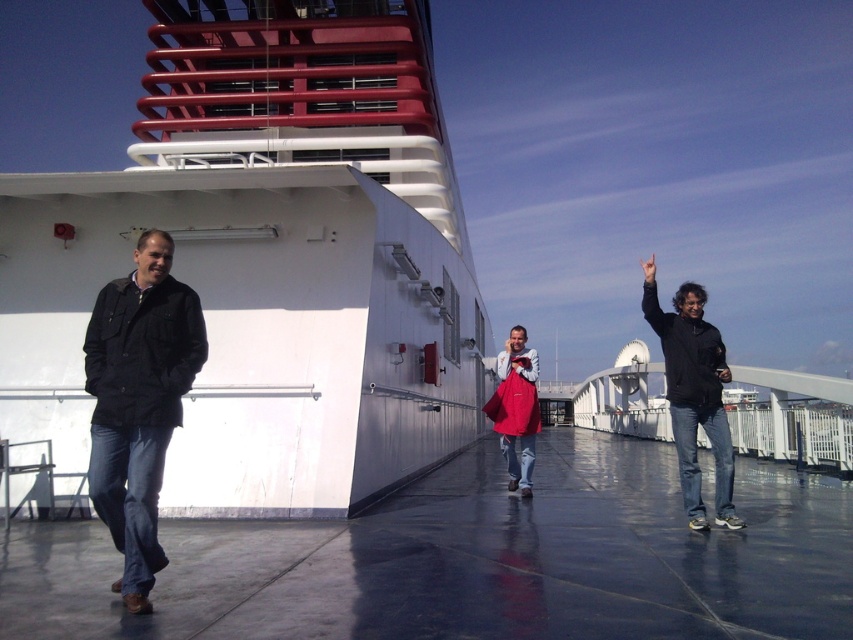
Question: From the image, what is the correct spatial relationship of white matte cruise ship at left in relation to glossy rubber deck at center?

Choices:
 (A) right
 (B) left

Answer: (B)

Question: Which point is closer to the camera?

Choices:
 (A) glossy rubber deck at center
 (B) matte red bag at center
 (C) black matte jacket at left

Answer: (A)

Question: Among these points, which one is farthest from the camera?

Choices:
 (A) (357, 634)
 (B) (502, 419)
 (C) (354, 160)

Answer: (C)

Question: Does black matte jacket at left appear under matte red bag at center?

Choices:
 (A) yes
 (B) no

Answer: (B)

Question: Can you confirm if glossy rubber deck at center is positioned to the left of black matte jacket at left?

Choices:
 (A) no
 (B) yes

Answer: (A)

Question: Which object is farther from the camera taking this photo?

Choices:
 (A) black matte jacket at left
 (B) white matte cruise ship at left
 (C) matte red bag at center
 (D) black matte jacket at right

Answer: (C)